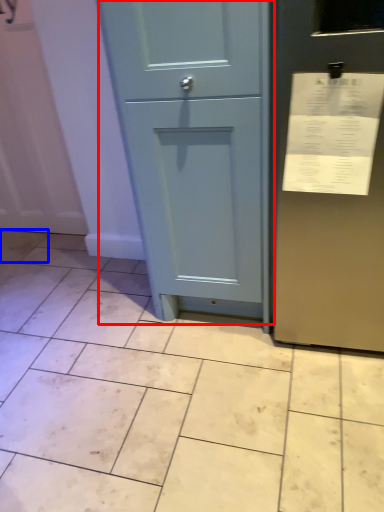
Question: Which object is closer to the camera taking this photo, door (highlighted by a red box) or ceramic tile (highlighted by a blue box)?

Choices:
 (A) door
 (B) ceramic tile

Answer: (A)